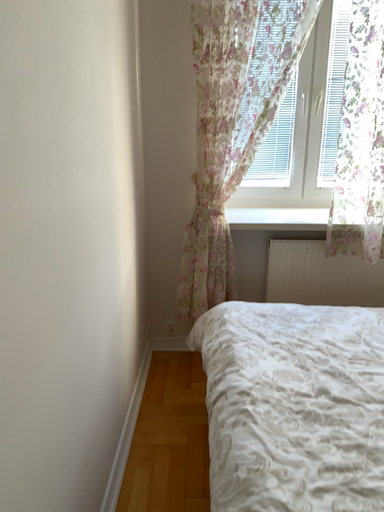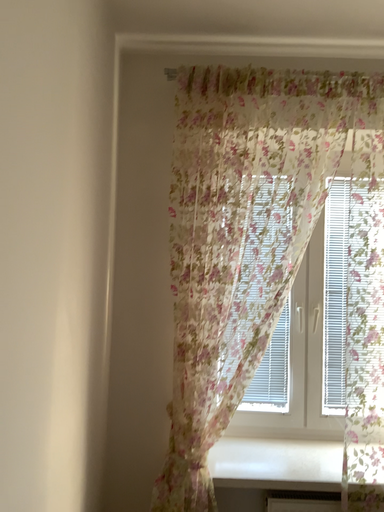
Question: How did the camera likely rotate when shooting the video?

Choices:
 (A) rotated downward
 (B) rotated upward

Answer: (B)